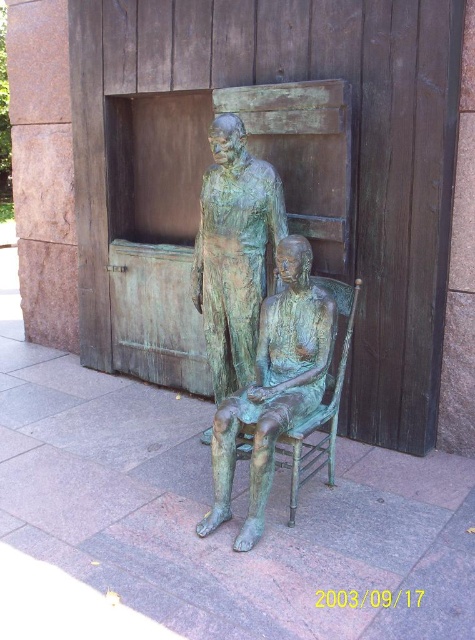
Is green patina statue at center taller than green patina bronze statue at center?

Correct, green patina statue at center is much taller as green patina bronze statue at center.

Is point (244, 413) positioned in front of point (241, 241)?

Yes, point (244, 413) is in front of point (241, 241).

Describe the element at coordinates (255, 321) in the screenshot. The image size is (475, 640). I see `green patina statue at center` at that location.

Locate an element on the screen. The width and height of the screenshot is (475, 640). green patina statue at center is located at coordinates (255, 321).